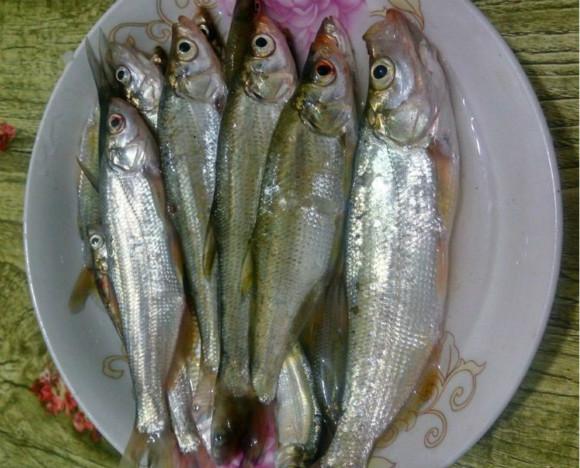
Identify the location of scales. This screenshot has width=580, height=468. (394, 275).